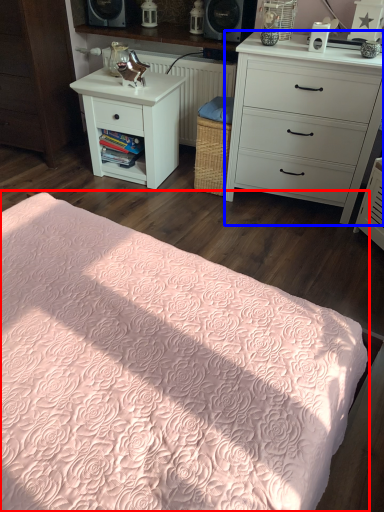
Question: Which object appears farthest to the camera in this image, bed (highlighted by a red box) or chest of drawers (highlighted by a blue box)?

Choices:
 (A) bed
 (B) chest of drawers

Answer: (B)